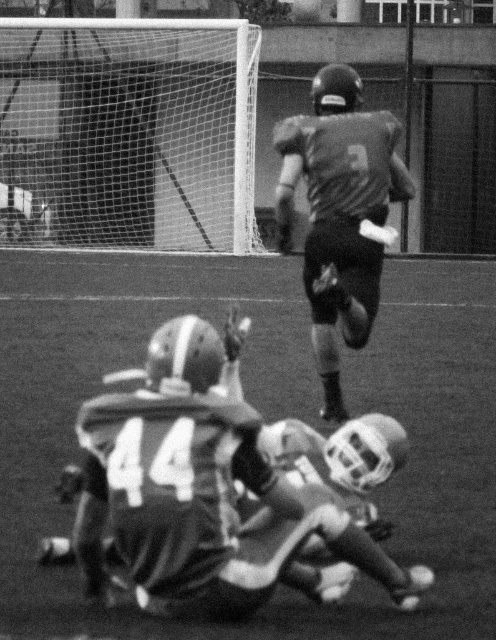
Question: Considering the relative positions of smooth turf football field at center and gray matte jersey at upper center in the image provided, where is smooth turf football field at center located with respect to gray matte jersey at upper center?

Choices:
 (A) above
 (B) below

Answer: (B)

Question: Which point is closer to the camera?

Choices:
 (A) (318, 269)
 (B) (426, 342)

Answer: (A)

Question: Observing the image, what is the correct spatial positioning of smooth turf football field at center in reference to gray matte jersey at upper center?

Choices:
 (A) above
 (B) below

Answer: (B)

Question: Is smooth turf football field at center above gray matte jersey at upper center?

Choices:
 (A) no
 (B) yes

Answer: (A)

Question: Which point is closer to the camera?

Choices:
 (A) (33, 472)
 (B) (323, 289)

Answer: (B)